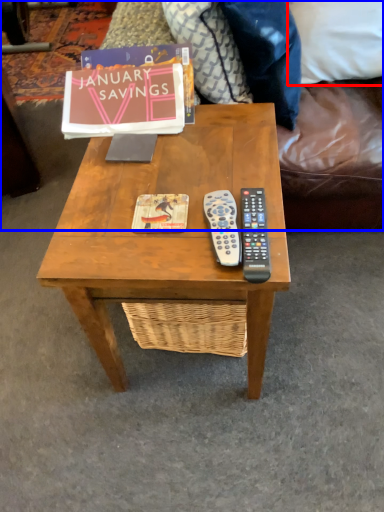
Question: Among these objects, which one is nearest to the camera, pillow (highlighted by a red box) or studio couch (highlighted by a blue box)?

Choices:
 (A) pillow
 (B) studio couch

Answer: (B)